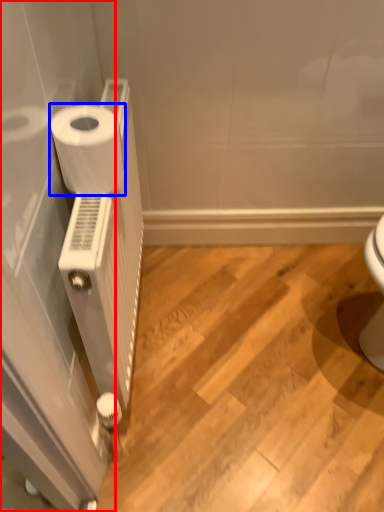
Question: Which object is further to the camera taking this photo, screen door (highlighted by a red box) or toilet paper (highlighted by a blue box)?

Choices:
 (A) screen door
 (B) toilet paper

Answer: (B)